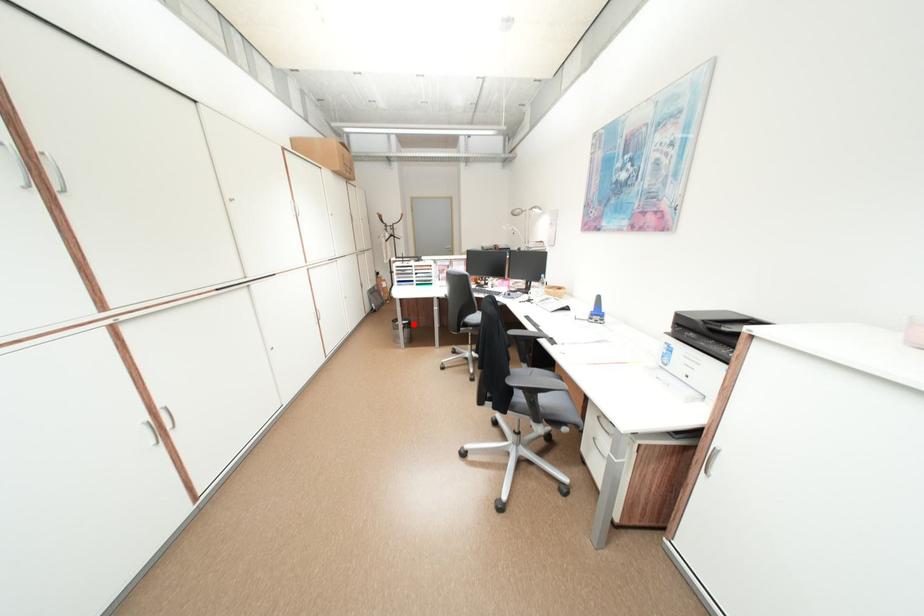
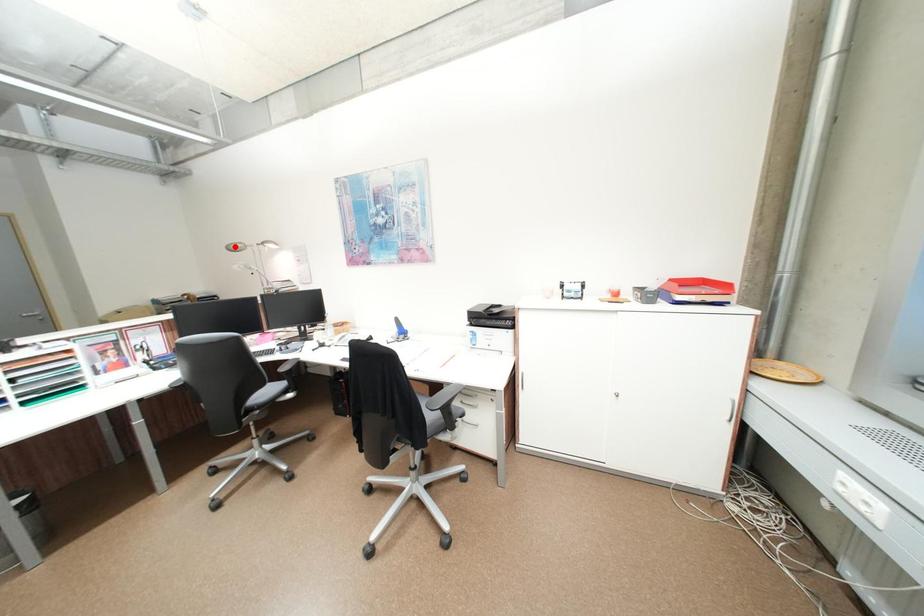
I am providing you with two images of the same scene from different viewpoints. A red point is marked on the first image and another point is marked on the second image. Is the marked point in image1 the same physical position as the marked point in image2?

No